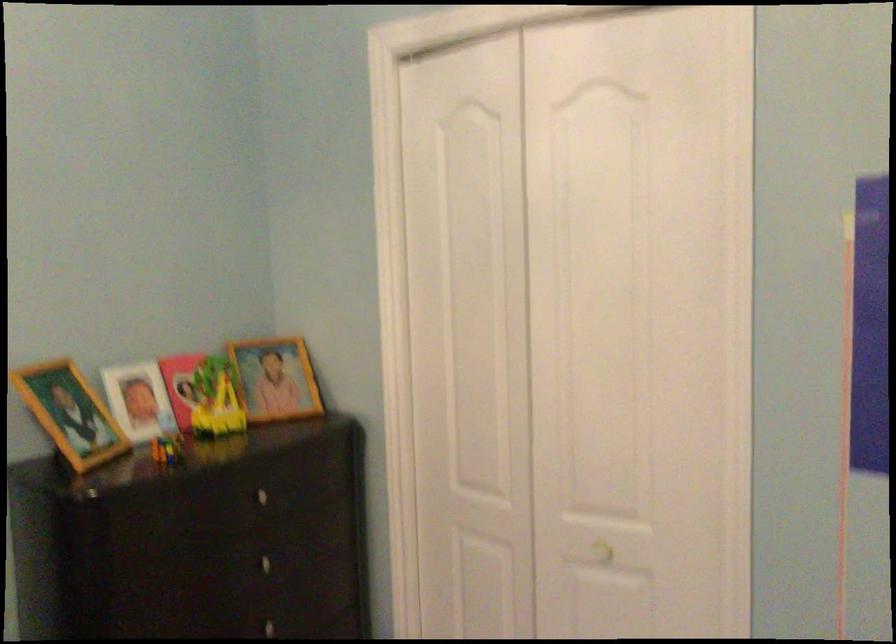
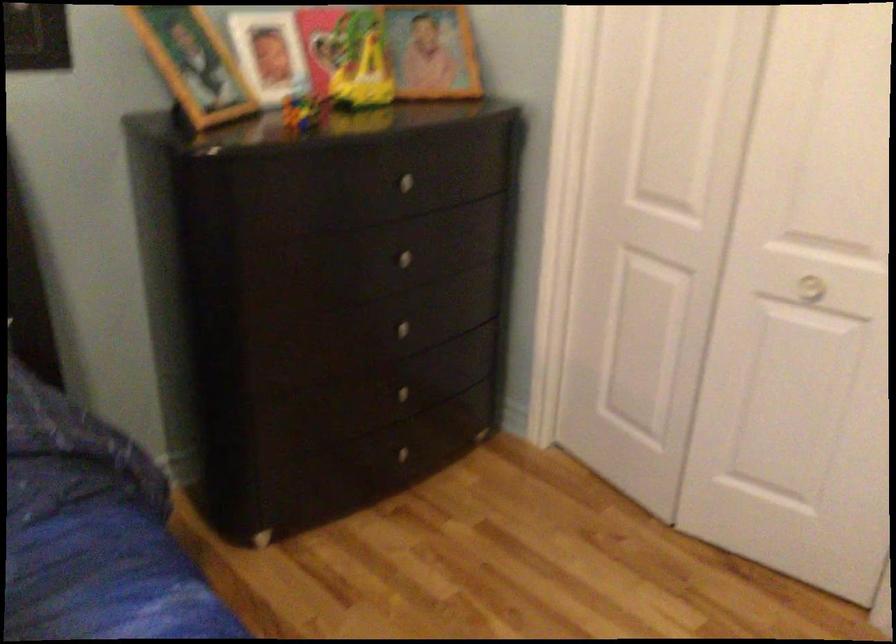
Where in the second image is the point corresponding to pixel 607 551 from the first image?

(810, 288)